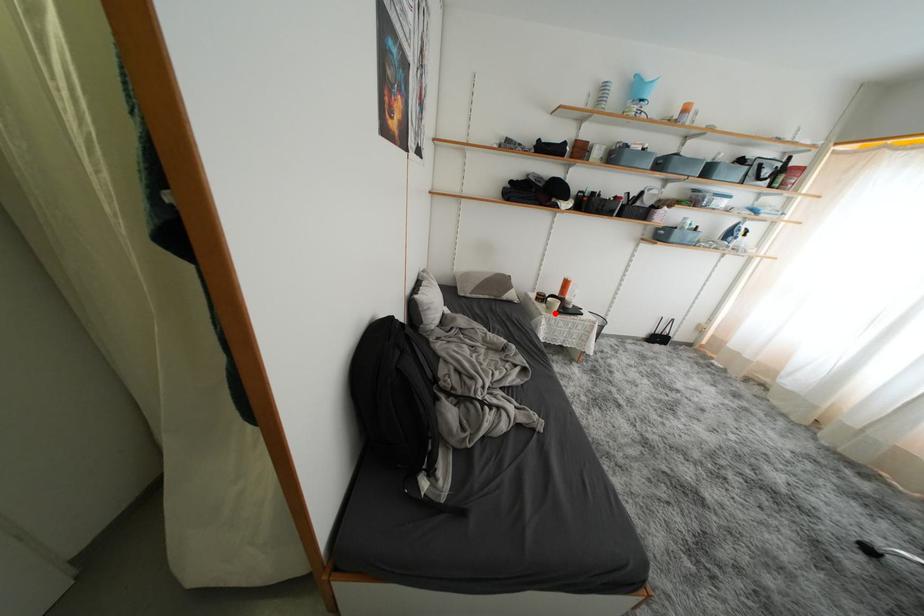
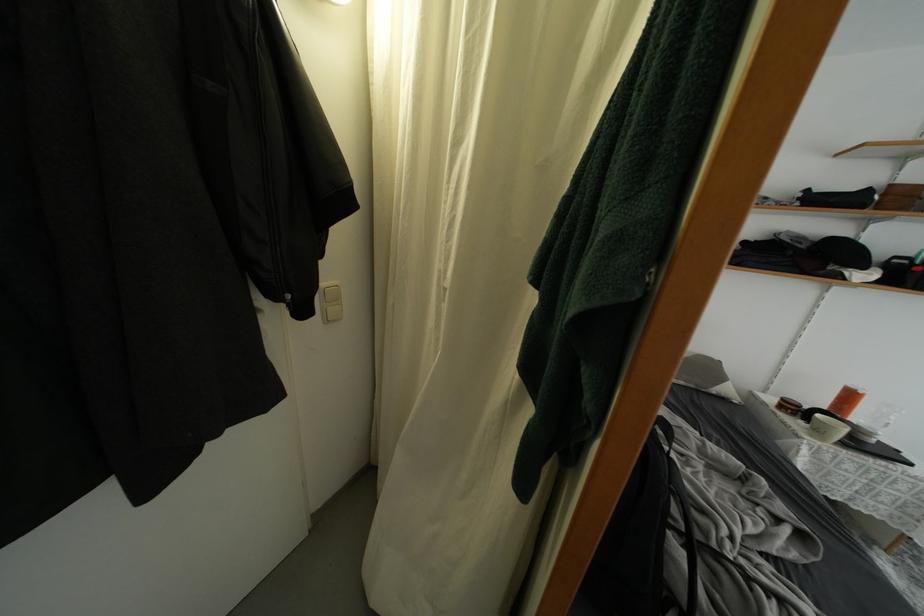
In the second image, find the point that corresponds to the highlighted location in the first image.

(823, 437)